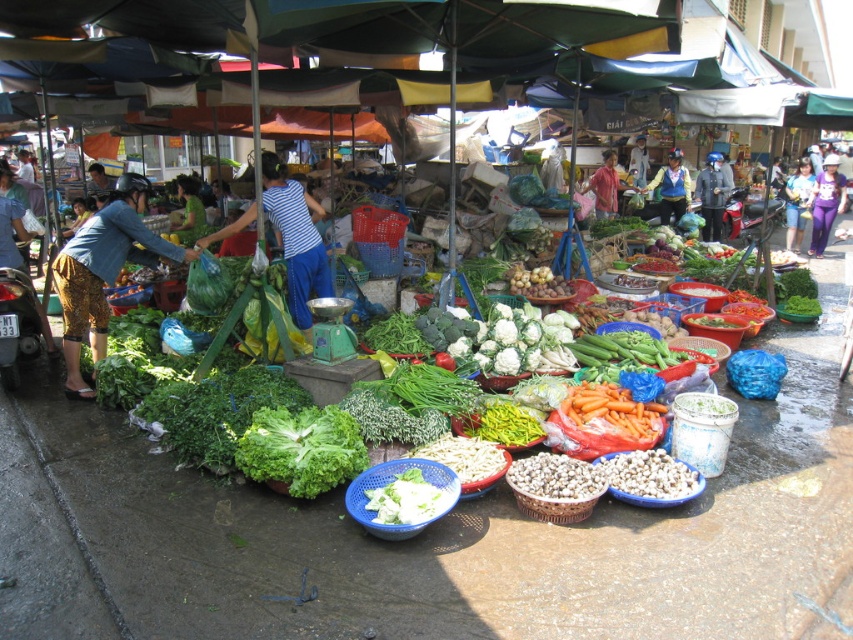
Question: Which of the following is the farthest from the observer?

Choices:
 (A) blue printed skirt at left
 (B) dark blue helmet at center
 (C) denim pants at center
 (D) blue striped shirt at center

Answer: (C)

Question: Can you confirm if yellow-green fabric bag at center is positioned to the right of denim pants at center?

Choices:
 (A) yes
 (B) no

Answer: (B)

Question: Which of these objects is positioned closest to the white matte cabbage at center?

Choices:
 (A) green leafy lettuce at center
 (B) blue striped shirt at center
 (C) blue printed skirt at left
 (D) yellow-green fabric bag at center

Answer: (A)

Question: Which point is closer to the camera?

Choices:
 (A) green fabric shirt at center
 (B) denim pants at center

Answer: (A)

Question: Is green leafy lettuce at center wider than dark blue helmet at center?

Choices:
 (A) yes
 (B) no

Answer: (A)

Question: Does blue printed skirt at left have a larger size compared to white matte cabbage at center?

Choices:
 (A) no
 (B) yes

Answer: (B)